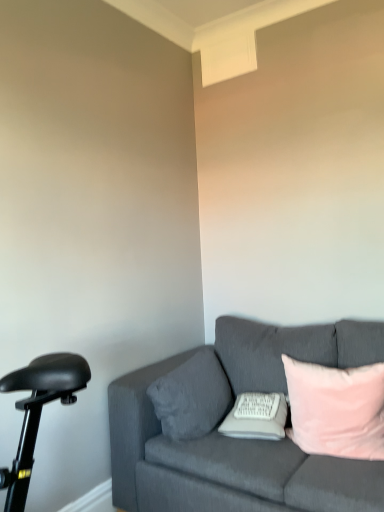
Question: From the image's perspective, is white soft pillow at center, which ranks as the 2th pillow in left-to-right order, above velvet gray pillow at center, positioned as the 1th pillow in left-to-right order?

Choices:
 (A) no
 (B) yes

Answer: (A)

Question: From a real-world perspective, is white soft pillow at center, which ranks as the 2th pillow in left-to-right order, physically below velvet gray pillow at center, positioned as the 1th pillow in left-to-right order?

Choices:
 (A) no
 (B) yes

Answer: (B)

Question: Is white soft pillow at center, the 2th pillow viewed from the right, located outside velvet gray pillow at center, the third pillow positioned from the right?

Choices:
 (A) yes
 (B) no

Answer: (A)

Question: Is white soft pillow at center, which ranks as the 2th pillow in left-to-right order, shorter than velvet gray pillow at center, the third pillow positioned from the right?

Choices:
 (A) no
 (B) yes

Answer: (B)

Question: From the image's perspective, is white soft pillow at center, which ranks as the 2th pillow in left-to-right order, beneath velvet gray pillow at center, the third pillow positioned from the right?

Choices:
 (A) yes
 (B) no

Answer: (A)

Question: In terms of height, does velvet gray pillow at center, the third pillow positioned from the right, look taller or shorter compared to velvet gray couch at right?

Choices:
 (A) short
 (B) tall

Answer: (A)

Question: Considering the relative positions of velvet gray pillow at center, positioned as the 1th pillow in left-to-right order, and velvet gray couch at right in the image provided, is velvet gray pillow at center, positioned as the 1th pillow in left-to-right order, to the left or to the right of velvet gray couch at right?

Choices:
 (A) right
 (B) left

Answer: (B)

Question: From a real-world perspective, is velvet gray pillow at center, the third pillow positioned from the right, positioned above or below velvet gray couch at right?

Choices:
 (A) below
 (B) above

Answer: (B)

Question: Considering their positions, is velvet gray pillow at center, the third pillow positioned from the right, located in front of or behind velvet gray couch at right?

Choices:
 (A) front
 (B) behind

Answer: (B)

Question: From the image's perspective, is velvet gray couch at right located above or below white soft pillow at center, which ranks as the 2th pillow in left-to-right order?

Choices:
 (A) below
 (B) above

Answer: (A)

Question: In the image, is velvet gray couch at right on the left side or the right side of white soft pillow at center, which ranks as the 2th pillow in left-to-right order?

Choices:
 (A) right
 (B) left

Answer: (A)

Question: Looking at the image, does velvet gray couch at right seem bigger or smaller compared to white soft pillow at center, which ranks as the 2th pillow in left-to-right order?

Choices:
 (A) big
 (B) small

Answer: (A)

Question: Is velvet gray couch at right in front of or behind white soft pillow at center, which ranks as the 2th pillow in left-to-right order, in the image?

Choices:
 (A) behind
 (B) front

Answer: (B)

Question: Considering the positions of white soft pillow at center, the 2th pillow viewed from the right, and pink velvet pillow at right, which ranks as the third pillow in left-to-right order, in the image, is white soft pillow at center, the 2th pillow viewed from the right, taller or shorter than pink velvet pillow at right, which ranks as the third pillow in left-to-right order,?

Choices:
 (A) short
 (B) tall

Answer: (A)

Question: From a real-world perspective, is white soft pillow at center, which ranks as the 2th pillow in left-to-right order, positioned above or below pink velvet pillow at right, which ranks as the third pillow in left-to-right order?

Choices:
 (A) above
 (B) below

Answer: (B)